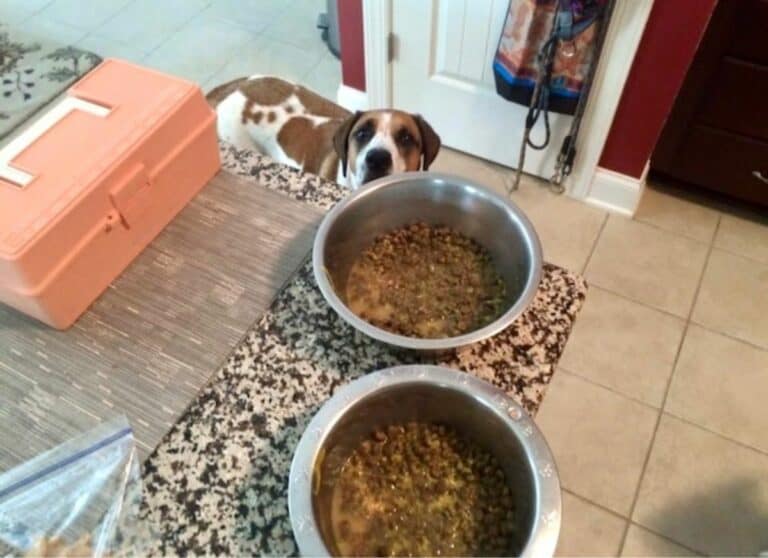
I want to click on white door, so click(439, 46).